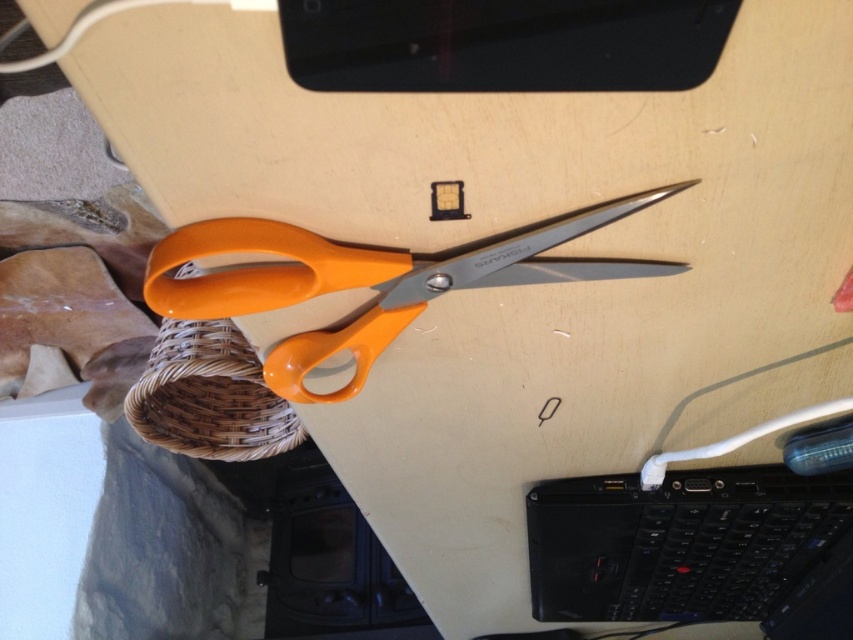
Question: Can you confirm if black plastic laptop at lower right is positioned to the right of orange plastic scissors at center?

Choices:
 (A) yes
 (B) no

Answer: (A)

Question: Is black plastic laptop at lower right smaller than orange plastic scissors at center?

Choices:
 (A) yes
 (B) no

Answer: (B)

Question: Can you confirm if black plastic laptop at lower right is positioned above orange plastic scissors at center?

Choices:
 (A) no
 (B) yes

Answer: (A)

Question: Which of the following is the closest to the observer?

Choices:
 (A) (758, 589)
 (B) (177, 234)

Answer: (B)